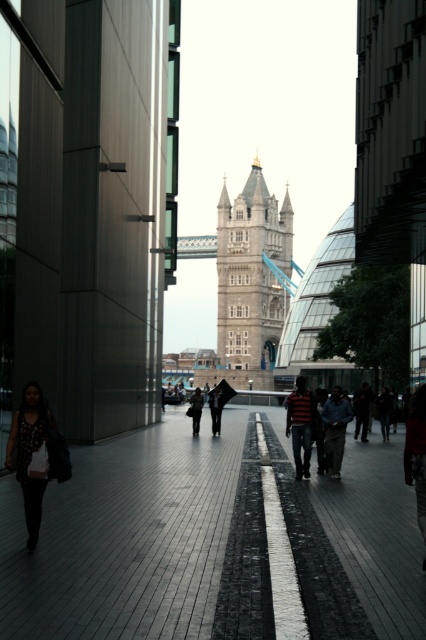
Looking at this image, is striped cotton shirt at center bigger than dark fabric jacket at center?

Correct, striped cotton shirt at center is larger in size than dark fabric jacket at center.

Is striped cotton shirt at center above dark fabric jacket at center?

Yes.

Where is `striped cotton shirt at center`? This screenshot has height=640, width=426. striped cotton shirt at center is located at coordinates (301, 424).

Where is `dark blue shirt at center`? dark blue shirt at center is located at coordinates (334, 429).

Does point (331, 412) come farther from viewer compared to point (216, 417)?

No, (331, 412) is in front of (216, 417).

Which is in front, point (344, 413) or point (215, 412)?

Point (344, 413) is more forward.

What are the coordinates of `dark blue shirt at center` in the screenshot? It's located at (334, 429).

Can you confirm if shiny black pavement at center is wider than polka dot dress at lower left?

Indeed, shiny black pavement at center has a greater width compared to polka dot dress at lower left.

Is point (264, 563) closer to viewer compared to point (26, 524)?

Yes, it is in front of point (26, 524).

The width and height of the screenshot is (426, 640). Find the location of `shiny black pavement at center`. shiny black pavement at center is located at coordinates (212, 540).